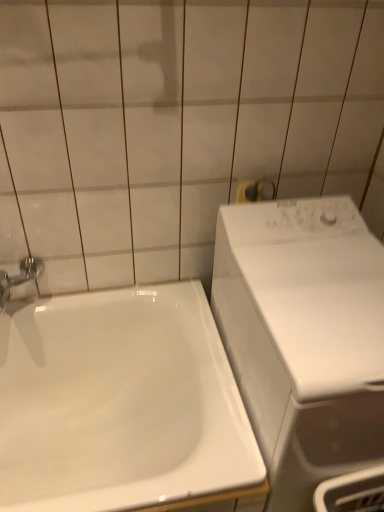
Question: Is chrome metallic faucet at left facing away from white glossy sink at lower left?

Choices:
 (A) no
 (B) yes

Answer: (A)

Question: From a real-world perspective, does chrome metallic faucet at left stand above white glossy sink at lower left?

Choices:
 (A) yes
 (B) no

Answer: (A)

Question: Considering the relative positions of chrome metallic faucet at left and white glossy sink at lower left in the image provided, is chrome metallic faucet at left to the left of white glossy sink at lower left from the viewer's perspective?

Choices:
 (A) no
 (B) yes

Answer: (B)

Question: Does chrome metallic faucet at left have a lesser height compared to white glossy sink at lower left?

Choices:
 (A) yes
 (B) no

Answer: (A)

Question: Is chrome metallic faucet at left far from white glossy sink at lower left?

Choices:
 (A) yes
 (B) no

Answer: (B)

Question: Does chrome metallic faucet at left have a lesser width compared to white glossy sink at lower left?

Choices:
 (A) no
 (B) yes

Answer: (B)

Question: Is white glossy washing machine at right oriented towards chrome metallic faucet at left?

Choices:
 (A) yes
 (B) no

Answer: (B)

Question: Is white glossy washing machine at right behind chrome metallic faucet at left?

Choices:
 (A) yes
 (B) no

Answer: (B)

Question: Does white glossy washing machine at right have a smaller size compared to chrome metallic faucet at left?

Choices:
 (A) yes
 (B) no

Answer: (B)

Question: Is white glossy washing machine at right positioned before chrome metallic faucet at left?

Choices:
 (A) no
 (B) yes

Answer: (B)

Question: Is white glossy washing machine at right thinner than chrome metallic faucet at left?

Choices:
 (A) no
 (B) yes

Answer: (A)

Question: From the image's perspective, would you say white glossy washing machine at right is shown under chrome metallic faucet at left?

Choices:
 (A) no
 (B) yes

Answer: (B)

Question: From the image's perspective, would you say white glossy washing machine at right is positioned over white glossy sink at lower left?

Choices:
 (A) yes
 (B) no

Answer: (A)